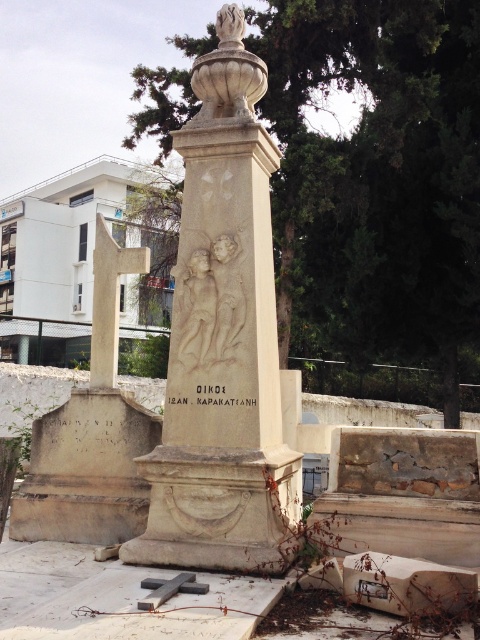
Between point (173, 449) and point (216, 321), which one is positioned behind?

The point (216, 321) is more distant.

Is point (184, 182) closer to viewer compared to point (233, 296)?

No, it is behind (233, 296).

This screenshot has width=480, height=640. In order to click on beige stone monument at center in this screenshot , I will do `click(223, 342)`.

Can you confirm if beige stone monument at center is bigger than matte stone statue at center?

Correct, beige stone monument at center is larger in size than matte stone statue at center.

Does beige stone monument at center appear on the right side of matte stone statue at center?

Correct, you'll find beige stone monument at center to the right of matte stone statue at center.

You are a GUI agent. You are given a task and a screenshot of the screen. Output one action in this format:
    pyautogui.click(x=<x>, y=<y>)
    Task: Click on the beige stone monument at center
    The width and height of the screenshot is (480, 640).
    Given the screenshot: What is the action you would take?
    pyautogui.click(x=223, y=342)

Is white stone relief at center positioned at the back of matte stone statue at center?

No, white stone relief at center is in front of matte stone statue at center.

Is point (222, 285) farther from camera compared to point (192, 324)?

Yes.

Identify the location of white stone relief at center. [x=228, y=291].

You are a GUI agent. You are given a task and a screenshot of the screen. Output one action in this format:
    pyautogui.click(x=<x>, y=<y>)
    Task: Click on the white stone relief at center
    The image size is (480, 640).
    Given the screenshot: What is the action you would take?
    pyautogui.click(x=228, y=291)